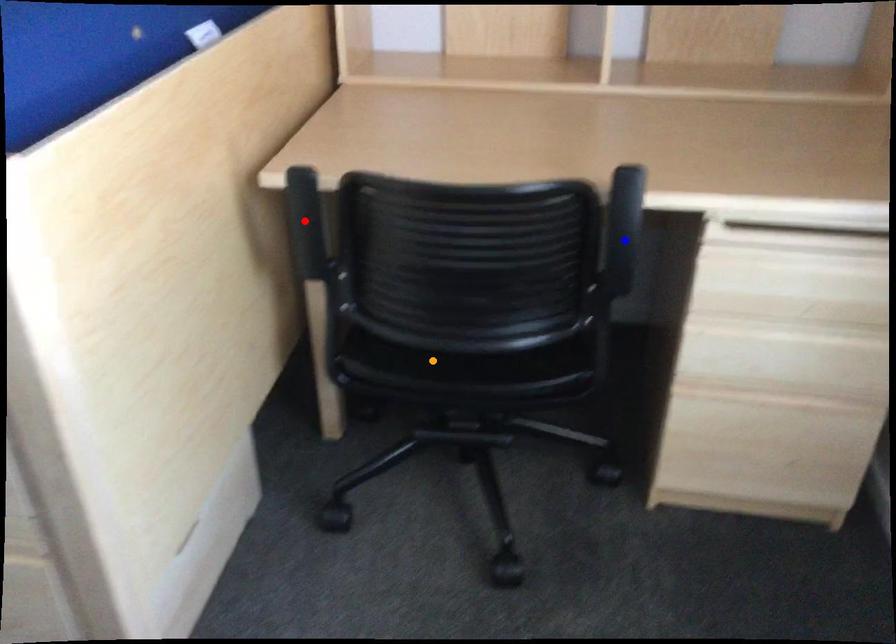
Order these from nearest to farthest:
A) blue point
B) orange point
C) red point

red point, blue point, orange point